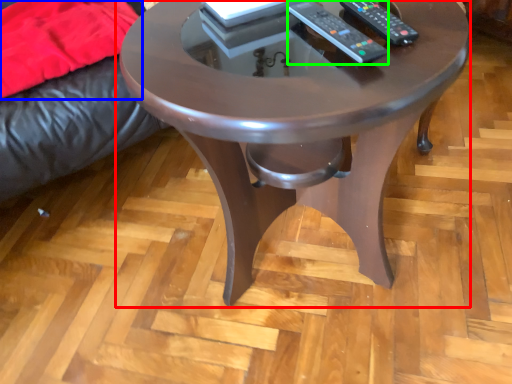
Question: Considering the real-world distances, which object is closest to coffee table (highlighted by a red box)? blanket (highlighted by a blue box) or remote (highlighted by a green box).

Choices:
 (A) blanket
 (B) remote

Answer: (B)